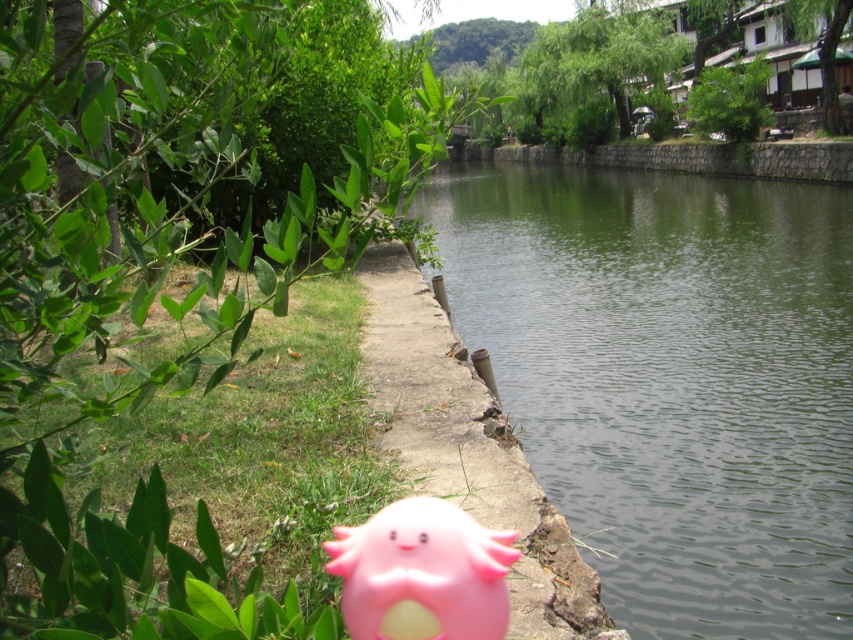
Who is positioned more to the right, green stone river at center or pink rubber toy at lower center?

green stone river at center is more to the right.

Who is more distant from viewer, [761,232] or [444,532]?

The point [761,232] is behind.

This screenshot has height=640, width=853. I want to click on green stone river at center, so (672, 380).

Does green stone river at center appear on the left side of concrete at center?

No, green stone river at center is not to the left of concrete at center.

Which is below, green stone river at center or concrete at center?

concrete at center is lower down.

Which is in front, point (663, 502) or point (375, 355)?

Point (375, 355) is more forward.

In order to click on green stone river at center in this screenshot , I will do `click(672, 380)`.

Between concrete at center and pink rubber toy at lower center, which one appears on the left side from the viewer's perspective?

pink rubber toy at lower center is more to the left.

Is point (409, 481) positioned behind point (492, 593)?

Yes, point (409, 481) is farther from viewer.

Locate an element on the screen. The width and height of the screenshot is (853, 640). concrete at center is located at coordinates (468, 448).